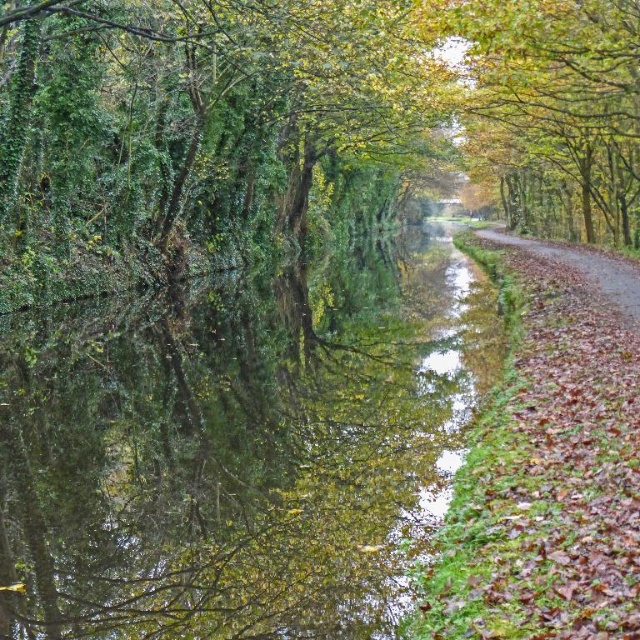
Is point (566, 51) closer to viewer compared to point (611, 272)?

Yes, it is in front of point (611, 272).

Is yellow-green leaves at upper center wider than brown dirt road at right?

Correct, the width of yellow-green leaves at upper center exceeds that of brown dirt road at right.

This screenshot has width=640, height=640. Identify the location of yellow-green leaves at upper center. (564, 92).

Where is `yellow-green leaves at upper center`? The image size is (640, 640). yellow-green leaves at upper center is located at coordinates (564, 92).